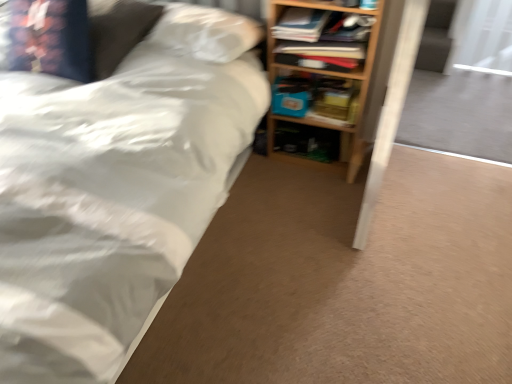
Question: Does wooden bookshelf at right have a greater height compared to white matte bed at upper left?

Choices:
 (A) no
 (B) yes

Answer: (A)

Question: From a real-world perspective, is wooden bookshelf at right positioned over white matte bed at upper left based on gravity?

Choices:
 (A) yes
 (B) no

Answer: (B)

Question: Can you confirm if wooden bookshelf at right is smaller than white matte bed at upper left?

Choices:
 (A) yes
 (B) no

Answer: (A)

Question: From a real-world perspective, is wooden bookshelf at right positioned under white matte bed at upper left based on gravity?

Choices:
 (A) yes
 (B) no

Answer: (A)

Question: Is wooden bookshelf at right at the left side of white matte bed at upper left?

Choices:
 (A) yes
 (B) no

Answer: (B)

Question: Does wooden bookshelf at right have a greater width compared to white matte bed at upper left?

Choices:
 (A) no
 (B) yes

Answer: (A)

Question: Could you tell me if transparent plastic screen door at upper right is facing blue matte paperback book at center?

Choices:
 (A) no
 (B) yes

Answer: (A)

Question: Is transparent plastic screen door at upper right positioned with its back to blue matte paperback book at center?

Choices:
 (A) no
 (B) yes

Answer: (A)

Question: Does transparent plastic screen door at upper right have a lesser width compared to blue matte paperback book at center?

Choices:
 (A) yes
 (B) no

Answer: (A)

Question: Does transparent plastic screen door at upper right lie behind blue matte paperback book at center?

Choices:
 (A) no
 (B) yes

Answer: (B)

Question: Considering the relative sizes of transparent plastic screen door at upper right and blue matte paperback book at center in the image provided, is transparent plastic screen door at upper right shorter than blue matte paperback book at center?

Choices:
 (A) no
 (B) yes

Answer: (A)

Question: From the image's perspective, would you say transparent plastic screen door at upper right is shown under blue matte paperback book at center?

Choices:
 (A) yes
 (B) no

Answer: (B)

Question: Is matte blue book at center, which ranks as the first book in back-to-front order, thinner than white matte bed at upper left?

Choices:
 (A) no
 (B) yes

Answer: (B)